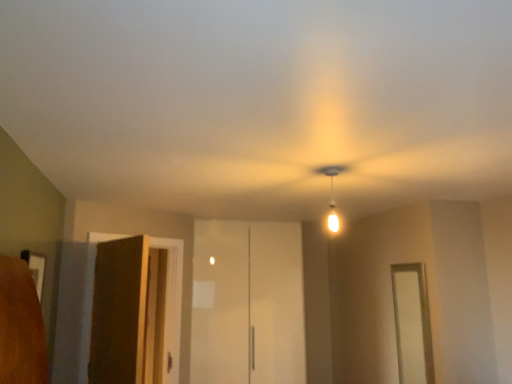
Find the location of a particular element. white glossy cabinet at center, the first elevator from the back is located at coordinates (247, 303).

What is the approximate height of white glossy cabinet at center, the first elevator from the back?

white glossy cabinet at center, the first elevator from the back, is 1.86 meters in height.

At what (x,y) coordinates should I click in order to perform the action: click on brown wood elevator at left, the second elevator from the right. Please return your answer as a coordinate pair (x, y). Looking at the image, I should click on (173, 297).

Considering the positions of objects white glossy door at right and brown wood elevator at left, arranged as the second elevator when viewed from the back, in the image provided, who is behind, white glossy door at right or brown wood elevator at left, arranged as the second elevator when viewed from the back,?

white glossy door at right is further away from the camera.

Could you tell me if white glossy door at right is facing brown wood elevator at left, the second elevator from the right?

Yes, white glossy door at right is oriented towards brown wood elevator at left, the second elevator from the right.

In the scene shown: Is white glossy door at right next to brown wood elevator at left, arranged as the second elevator when viewed from the back?

white glossy door at right and brown wood elevator at left, arranged as the second elevator when viewed from the back, are clearly separated.

From the image's perspective, is white glossy door at right below brown wood elevator at left, the second elevator from the right?

Indeed, from the image's perspective, white glossy door at right is shown beneath brown wood elevator at left, the second elevator from the right.

Considering the sizes of matte white bulb at center and white glossy cabinet at center, which is counted as the 1th elevator, starting from the right, in the image, is matte white bulb at center taller or shorter than white glossy cabinet at center, which is counted as the 1th elevator, starting from the right,?

matte white bulb at center is shorter than white glossy cabinet at center, which is counted as the 1th elevator, starting from the right.

Is matte white bulb at center not within white glossy cabinet at center, the first elevator from the back?

Yes, matte white bulb at center is located beyond the bounds of white glossy cabinet at center, the first elevator from the back.

Between matte white bulb at center and white glossy cabinet at center, the first elevator from the back, which one appears on the left side from the viewer's perspective?

From the viewer's perspective, white glossy cabinet at center, the first elevator from the back, appears more on the left side.

Based on the photo, are matte white bulb at center and white glossy cabinet at center, which is counted as the 1th elevator, starting from the right, making contact?

They are not placed beside each other.

Would you consider white glossy door at right to be distant from matte white bulb at center?

Yes, white glossy door at right and matte white bulb at center are located far from each other.

Is white glossy door at right not inside matte white bulb at center?

Yes, white glossy door at right is not within matte white bulb at center.

Does white glossy door at right have a greater height compared to matte white bulb at center?

Correct, white glossy door at right is much taller as matte white bulb at center.

Relative to matte white bulb at center, is white glossy door at right in front or behind?

Clearly, white glossy door at right is behind matte white bulb at center.

Between brown wood elevator at left, the second elevator from the right, and white glossy door at right, which one appears on the right side from the viewer's perspective?

From the viewer's perspective, white glossy door at right appears more on the right side.

Can you confirm if brown wood elevator at left, arranged as the second elevator when viewed from the back, is shorter than white glossy door at right?

No, brown wood elevator at left, arranged as the second elevator when viewed from the back, is not shorter than white glossy door at right.

From the image's perspective, is brown wood elevator at left, the second elevator from the right, beneath white glossy door at right?

No, from the image's perspective, brown wood elevator at left, the second elevator from the right, is not below white glossy door at right.

Would you say brown wood elevator at left, arranged as the second elevator when viewed from the back, is inside or outside white glossy door at right?

brown wood elevator at left, arranged as the second elevator when viewed from the back, is located beyond the bounds of white glossy door at right.

Between point (210, 228) and point (331, 205), which one is positioned in front?

The point (331, 205) is closer.

Considering the sizes of white glossy cabinet at center, which is counted as the 1th elevator, starting from the right, and matte white bulb at center in the image, is white glossy cabinet at center, which is counted as the 1th elevator, starting from the right, wider or thinner than matte white bulb at center?

Considering their sizes, white glossy cabinet at center, which is counted as the 1th elevator, starting from the right, looks broader than matte white bulb at center.

Which of these two, white glossy cabinet at center, which is counted as the 1th elevator, starting from the right, or matte white bulb at center, is bigger?

With larger size is white glossy cabinet at center, which is counted as the 1th elevator, starting from the right.

From the image's perspective, is white glossy cabinet at center, positioned as the 2th elevator in front-to-back order, on top of matte white bulb at center?

No.

Is white glossy cabinet at center, positioned as the 2th elevator in front-to-back order, at the left side of white glossy door at right?

Correct, you'll find white glossy cabinet at center, positioned as the 2th elevator in front-to-back order, to the left of white glossy door at right.

From a real-world perspective, starting from the white glossy door at right, which elevator is the 1st one vertically above it? Please provide its 2D coordinates.

[(247, 303)]

Is white glossy cabinet at center, which is counted as the 1th elevator, starting from the right, positioned with its back to white glossy door at right?

No, white glossy cabinet at center, which is counted as the 1th elevator, starting from the right, is not facing away from white glossy door at right.

Is white glossy cabinet at center, the 2th elevator from the left, situated inside white glossy door at right or outside?

white glossy cabinet at center, the 2th elevator from the left, is located beyond the bounds of white glossy door at right.

From the image's perspective, is brown wood elevator at left, arranged as the second elevator when viewed from the back, below matte white bulb at center?

Yes, from the image's perspective, brown wood elevator at left, arranged as the second elevator when viewed from the back, is beneath matte white bulb at center.

Is brown wood elevator at left, the 1th elevator positioned from the front, oriented away from matte white bulb at center?

brown wood elevator at left, the 1th elevator positioned from the front, is not turned away from matte white bulb at center.

In the scene shown: Can you tell me how much brown wood elevator at left, the second elevator from the right, and matte white bulb at center differ in facing direction?

The angular difference between brown wood elevator at left, the second elevator from the right, and matte white bulb at center is 53.2 degrees.

Does brown wood elevator at left, the second elevator from the right, have a lesser height compared to matte white bulb at center?

No.

In the image, there is a brown wood elevator at left, the first elevator viewed from the left. At what (x,y) coordinates should I click in order to perform the action: click on window below it (from a real-world perspective). Please return your answer as a coordinate pair (x, y). Looking at the image, I should click on (412, 324).

You are a GUI agent. You are given a task and a screenshot of the screen. Output one action in this format:
    pyautogui.click(x=<x>, y=<y>)
    Task: Click on the 2nd elevator behind the matte white bulb at center, starting your count from the anchor
    Image resolution: width=512 pixels, height=384 pixels.
    Given the screenshot: What is the action you would take?
    pyautogui.click(x=247, y=303)

From the image, which object appears to be nearer to matte white bulb at center, white glossy door at right or white glossy cabinet at center, the first elevator from the back?

Among the two, white glossy door at right is located nearer to matte white bulb at center.

Based on their spatial positions, is matte white bulb at center or white glossy cabinet at center, the first elevator from the back, further from white glossy door at right?

The object further to white glossy door at right is white glossy cabinet at center, the first elevator from the back.

When comparing their distances from brown wood elevator at left, arranged as the second elevator when viewed from the back, does matte white bulb at center or white glossy door at right seem closer?

Among the two, matte white bulb at center is located nearer to brown wood elevator at left, arranged as the second elevator when viewed from the back.

Looking at the image, which one is located further to white glossy cabinet at center, the 2th elevator from the left, white glossy door at right or matte white bulb at center?

matte white bulb at center is further to white glossy cabinet at center, the 2th elevator from the left.

Based on their spatial positions, is brown wood elevator at left, the second elevator from the right, or white glossy cabinet at center, the first elevator from the back, closer to white glossy door at right?

white glossy cabinet at center, the first elevator from the back, is closer to white glossy door at right.

Considering their positions, is white glossy cabinet at center, the 2th elevator from the left, positioned further to white glossy door at right than brown wood elevator at left, the second elevator from the right?

brown wood elevator at left, the second elevator from the right, is positioned further to the anchor white glossy door at right.

When comparing their distances from white glossy cabinet at center, the 2th elevator from the left, does white glossy door at right or brown wood elevator at left, the second elevator from the right, seem further?

white glossy door at right is positioned further to the anchor white glossy cabinet at center, the 2th elevator from the left.

Which object lies further to the anchor point brown wood elevator at left, the second elevator from the right, white glossy cabinet at center, the first elevator from the back, or white glossy door at right?

Among the two, white glossy door at right is located further to brown wood elevator at left, the second elevator from the right.

Where is `light fixture between brown wood elevator at left, the 1th elevator positioned from the front, and white glossy door at right, in the horizontal direction`? This screenshot has width=512, height=384. light fixture between brown wood elevator at left, the 1th elevator positioned from the front, and white glossy door at right, in the horizontal direction is located at coordinates (x=332, y=195).

In order to click on elevator between matte white bulb at center and white glossy cabinet at center, which is counted as the 1th elevator, starting from the right, from front to back in this screenshot , I will do `click(173, 297)`.

You are a GUI agent. You are given a task and a screenshot of the screen. Output one action in this format:
    pyautogui.click(x=<x>, y=<y>)
    Task: Click on the window between matte white bulb at center and white glossy cabinet at center, the 2th elevator from the left, from front to back
    The image size is (512, 384).
    Given the screenshot: What is the action you would take?
    pyautogui.click(x=412, y=324)

Find the location of a particular element. This screenshot has width=512, height=384. elevator between brown wood elevator at left, the 1th elevator positioned from the front, and white glossy door at right is located at coordinates (247, 303).